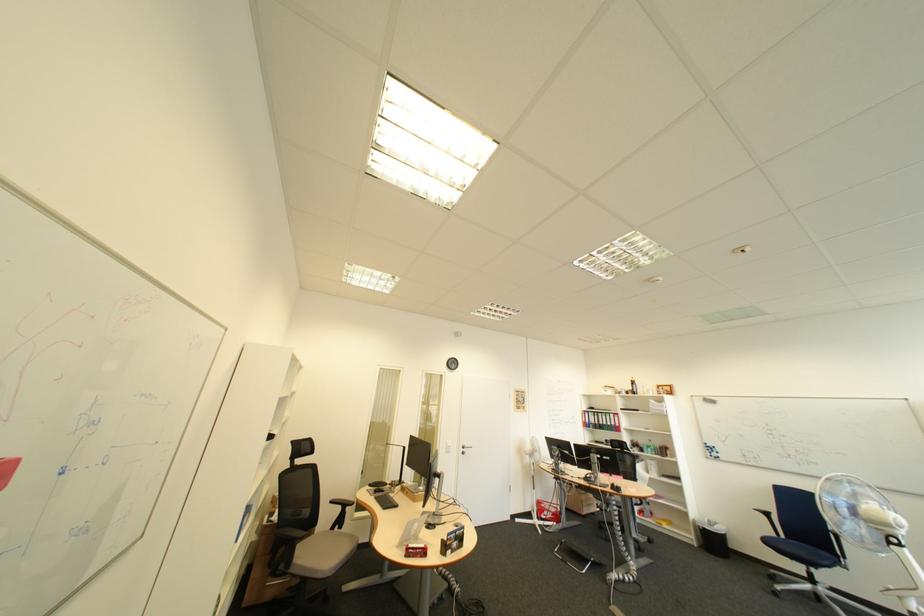
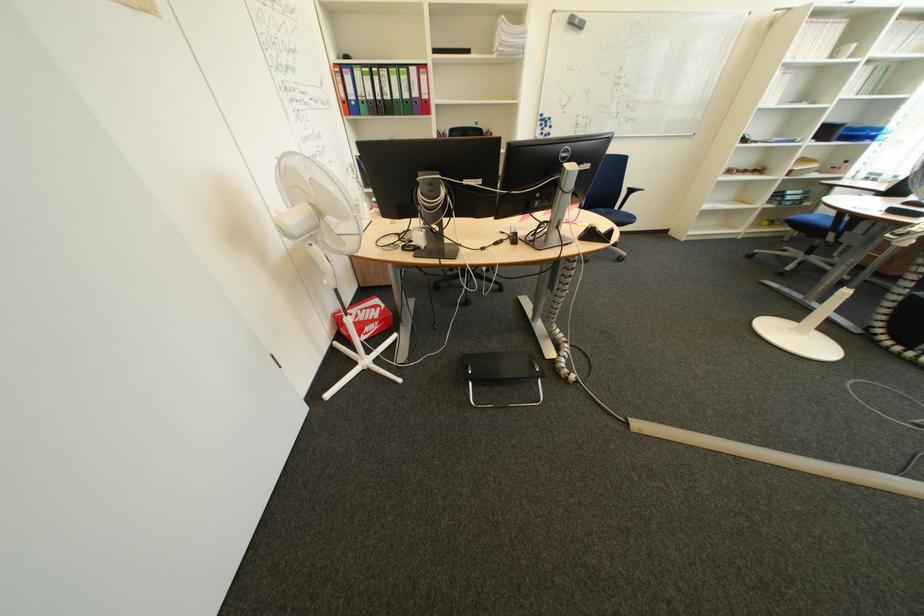
Locate, in the second image, the point that corresponds to (x=562, y=514) in the first image.

(385, 326)